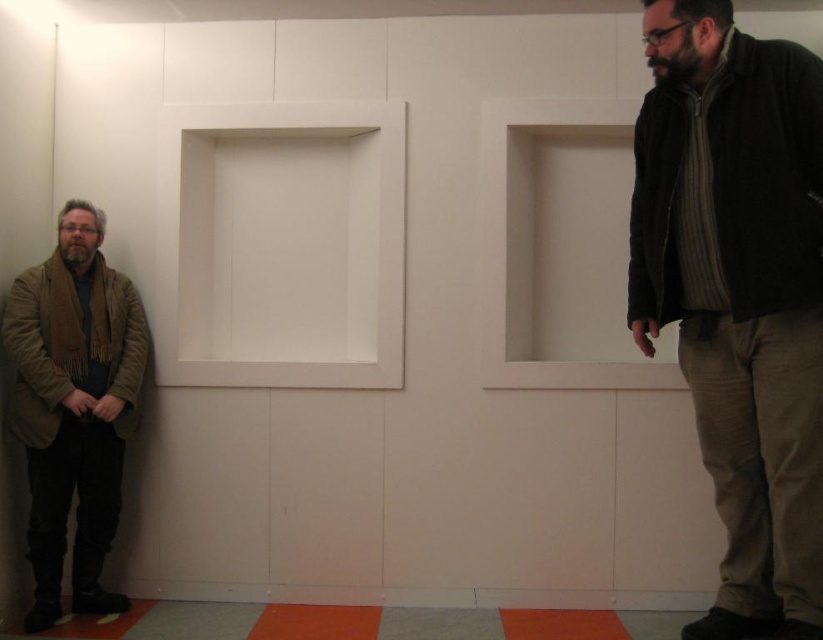
Is brown corduroy jacket at left taller than brown leather jacket at lower left?

Yes.

Can you confirm if brown corduroy jacket at left is positioned above brown leather jacket at lower left?

Actually, brown corduroy jacket at left is below brown leather jacket at lower left.

The image size is (823, 640). I want to click on brown corduroy jacket at left, so click(73, 406).

Does point (794, 266) lie behind point (49, 292)?

No, (794, 266) is in front of (49, 292).

Which of these two, dark brown leather jacket at right or brown leather jacket at lower left, stands shorter?

brown leather jacket at lower left

You are a GUI agent. You are given a task and a screenshot of the screen. Output one action in this format:
    pyautogui.click(x=<x>, y=<y>)
    Task: Click on the dark brown leather jacket at right
    The image size is (823, 640).
    Given the screenshot: What is the action you would take?
    pyautogui.click(x=737, y=294)

Which of these two, brown corduroy jacket at left or black fuzzy jacket at upper right, stands taller?

brown corduroy jacket at left

Is brown corduroy jacket at left bigger than black fuzzy jacket at upper right?

Yes, brown corduroy jacket at left is bigger than black fuzzy jacket at upper right.

Identify the location of brown corduroy jacket at left. (73, 406).